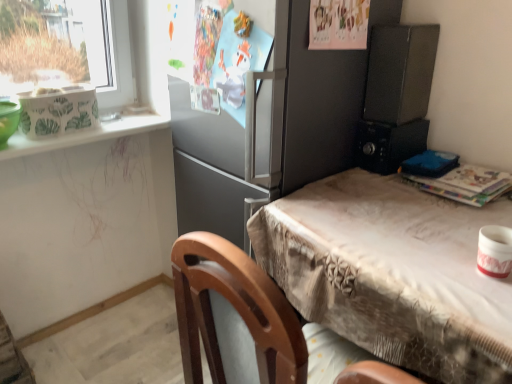
Question: From a real-world perspective, is matte black microwave at upper right, the first appliance when ordered from top to bottom, positioned above or below black plastic microwave at right, which is the second appliance in bottom-to-top order?

Choices:
 (A) above
 (B) below

Answer: (A)

Question: Is matte black microwave at upper right, the first appliance when ordered from top to bottom, bigger or smaller than black plastic microwave at right, which is the second appliance in top-to-bottom order?

Choices:
 (A) big
 (B) small

Answer: (A)

Question: Based on their relative distances, which object is nearer to the black plastic microwave at right, which is the second appliance in top-to-bottom order?

Choices:
 (A) satin gray refrigerator at center
 (B) white glossy window sill at upper left
 (C) white glossy mug at upper right, which ranks as the third appliance in top-to-bottom order
 (D) beige fabric table at center
 (E) matte black microwave at upper right, positioned as the 3th appliance in bottom-to-top order

Answer: (E)

Question: Considering the real-world distances, which object is closest to the beige fabric table at center?

Choices:
 (A) white glossy window sill at upper left
 (B) matte black microwave at upper right, the first appliance when ordered from top to bottom
 (C) white glossy mug at upper right, which is the third appliance in back-to-front order
 (D) satin gray refrigerator at center
 (E) black plastic microwave at right, which appears as the 1th appliance when viewed from the back

Answer: (C)